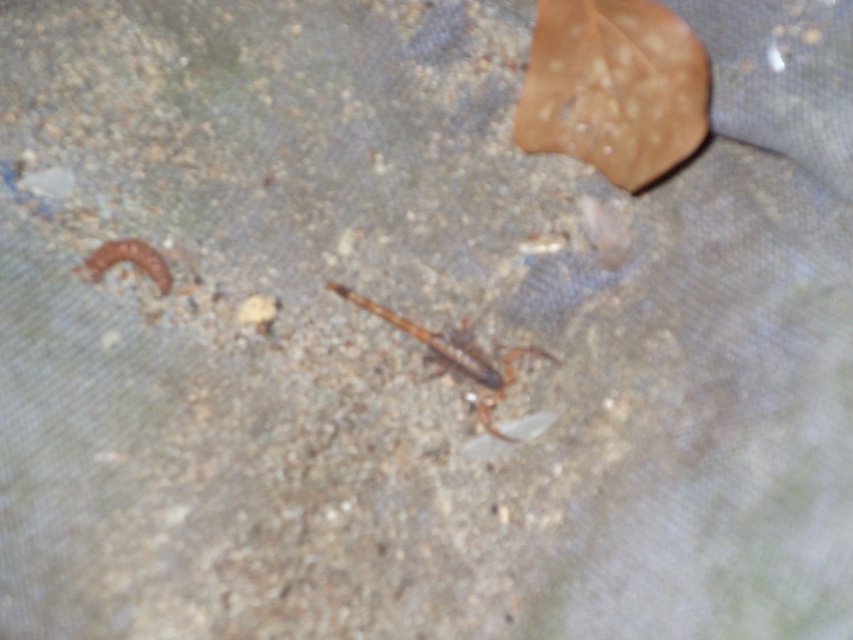
Question: Can you confirm if brown scaly insect at center is positioned below brown fuzzy worm at left?

Choices:
 (A) no
 (B) yes

Answer: (B)

Question: Which of the following is the farthest from the observer?

Choices:
 (A) brown scaly insect at center
 (B) brown fuzzy worm at left

Answer: (A)

Question: Among these points, which one is farthest from the camera?

Choices:
 (A) (531, 48)
 (B) (339, 292)

Answer: (A)

Question: Which object is farther from the camera taking this photo?

Choices:
 (A) brown scaly insect at center
 (B) brown matte leaf at upper right
 (C) brown fuzzy worm at left

Answer: (B)

Question: Does brown scaly insect at center have a greater width compared to brown fuzzy worm at left?

Choices:
 (A) yes
 (B) no

Answer: (A)

Question: Can you confirm if brown matte leaf at upper right is thinner than brown fuzzy worm at left?

Choices:
 (A) yes
 (B) no

Answer: (B)